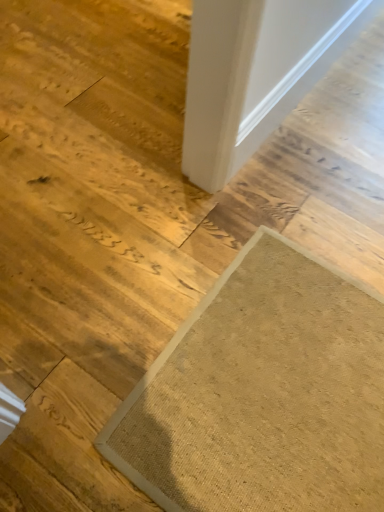
The image size is (384, 512). Find the location of `free area below textured beige mat at lower right (from a real-world perspective)`. free area below textured beige mat at lower right (from a real-world perspective) is located at coordinates (284, 390).